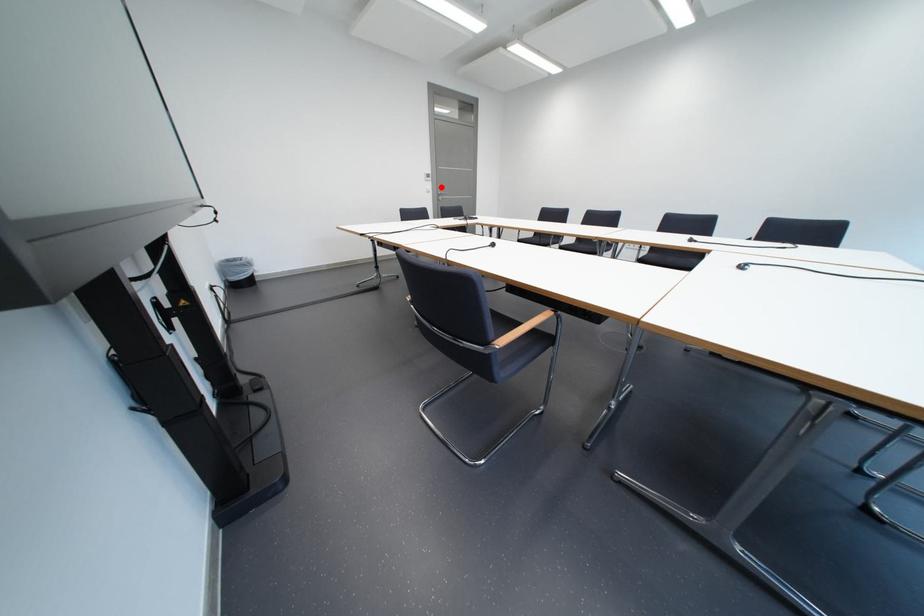
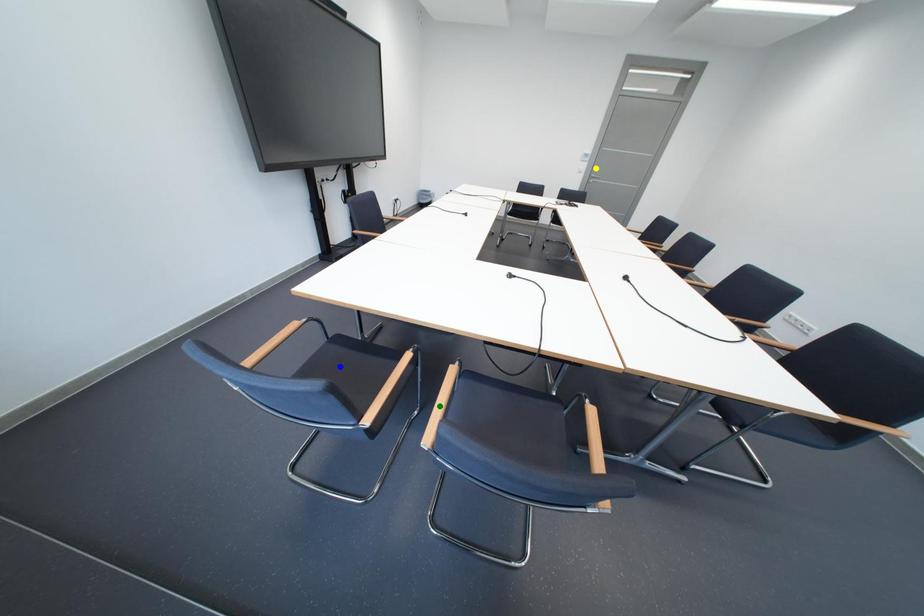
Question: I am providing you with two images of the same scene from different viewpoints. A red point is marked on the first image. You are given multiple points on the second image. Which mark in image 2 goes with the point in image 1?

Choices:
 (A) yellow point
 (B) blue point
 (C) green point

Answer: (A)